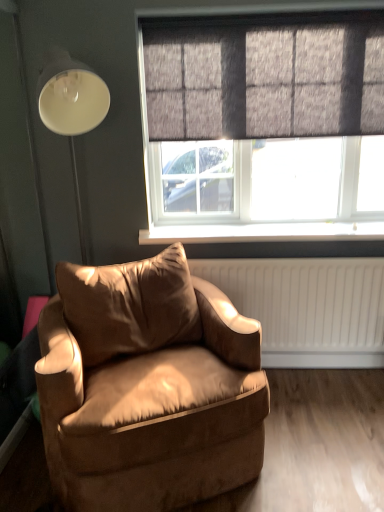
Identify the location of free spot to the right of suede-like brown armchair at lower left. This screenshot has width=384, height=512. (318, 425).